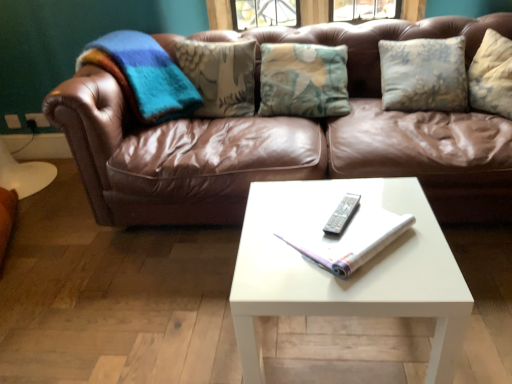
Identify the location of vacant space in white glossy coffee table at center (from a real-world perspective). This screenshot has width=512, height=384. (325, 351).